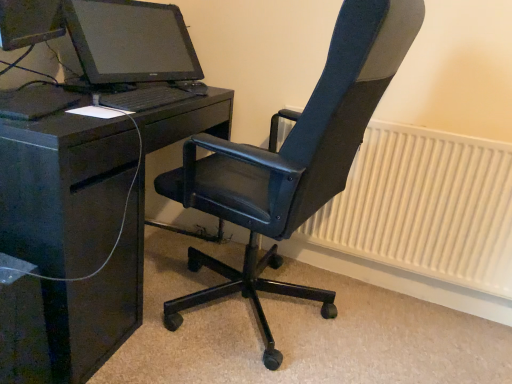
At what (x,y) coordinates should I click in order to perform the action: click on vacant space underneath black leather office chair at center (from a real-world perspective). Please return your answer as a coordinate pair (x, y). This screenshot has height=384, width=512. Looking at the image, I should click on [259, 312].